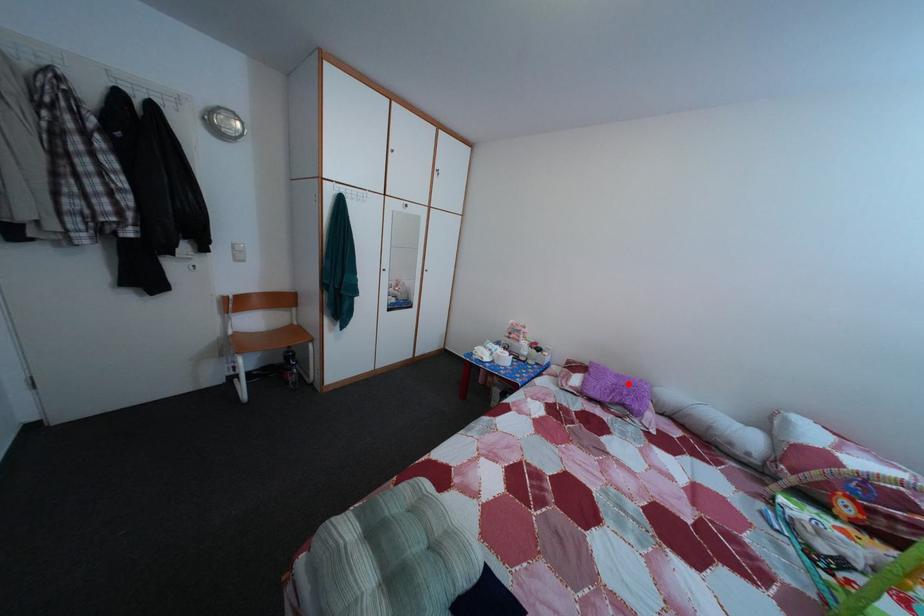
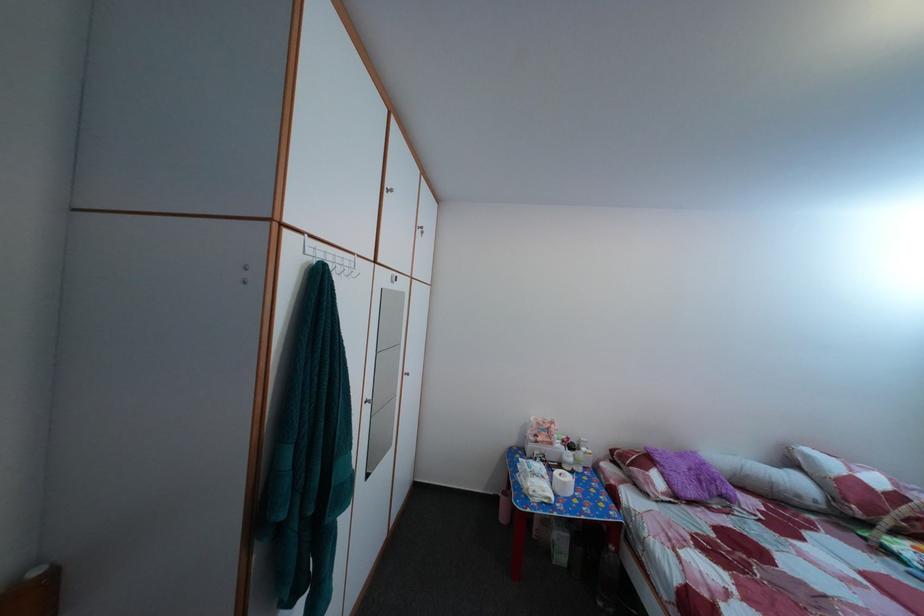
Question: I am providing you with two images of the same scene from different viewpoints. A red point is marked on the first image. Is the red point's position out of view in image 2?

Choices:
 (A) Yes
 (B) No

Answer: (B)